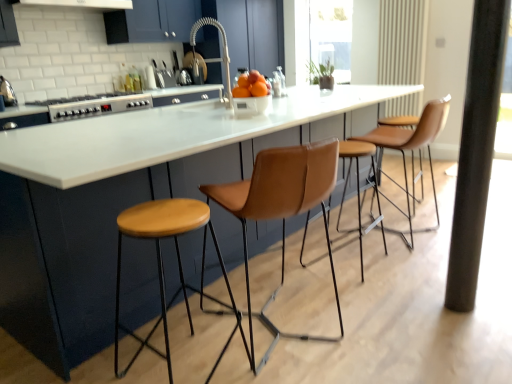
Identify the location of free spot behind leather at center, which appears as the first chair when viewed from the left. This screenshot has height=384, width=512. (288, 268).